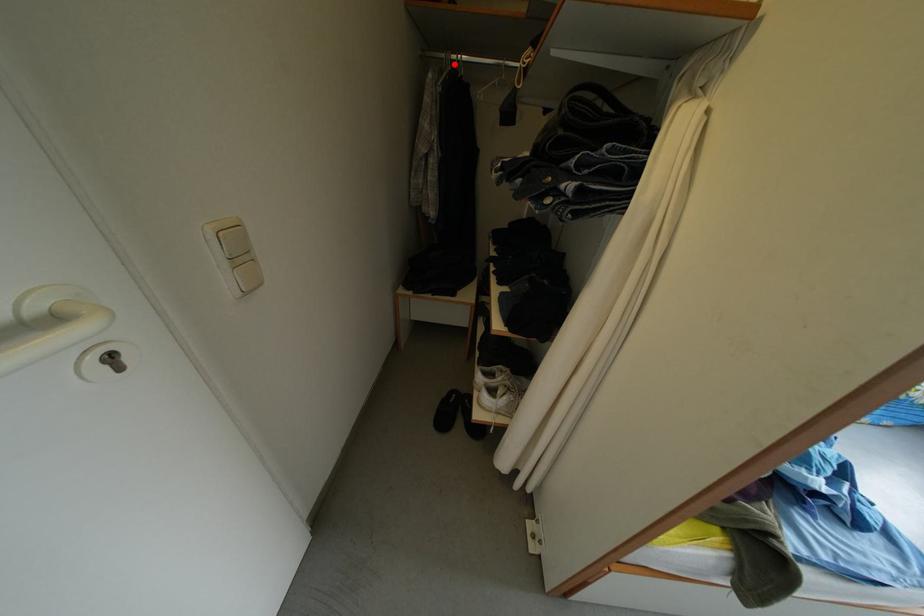
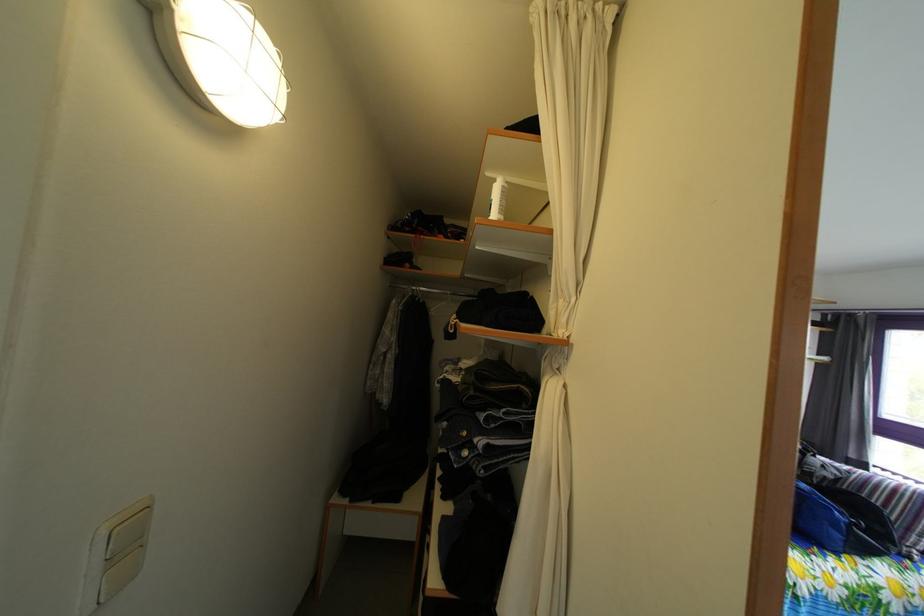
The point at the highlighted location is marked in the first image. Where is the corresponding point in the second image?

(418, 294)